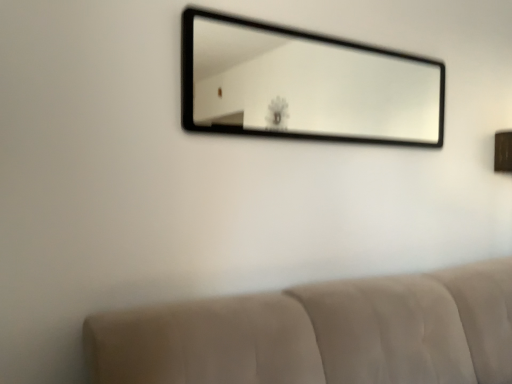
Question: In terms of width, does beige fabric couch at lower center look wider or thinner when compared to black glass mirror at upper center?

Choices:
 (A) wide
 (B) thin

Answer: (A)

Question: Does point (323, 307) appear closer or farther from the camera than point (313, 66)?

Choices:
 (A) farther
 (B) closer

Answer: (B)

Question: From the image's perspective, is beige fabric couch at lower center positioned above or below black glass mirror at upper center?

Choices:
 (A) above
 (B) below

Answer: (B)

Question: Considering the positions of black glass mirror at upper center and beige fabric couch at lower center in the image, is black glass mirror at upper center bigger or smaller than beige fabric couch at lower center?

Choices:
 (A) small
 (B) big

Answer: (A)

Question: Considering the positions of point (211, 46) and point (436, 291), is point (211, 46) closer or farther from the camera than point (436, 291)?

Choices:
 (A) closer
 (B) farther

Answer: (B)

Question: Based on their positions, is black glass mirror at upper center located to the left or right of beige fabric couch at lower center?

Choices:
 (A) left
 (B) right

Answer: (B)

Question: Is black glass mirror at upper center inside or outside of beige fabric couch at lower center?

Choices:
 (A) outside
 (B) inside

Answer: (A)